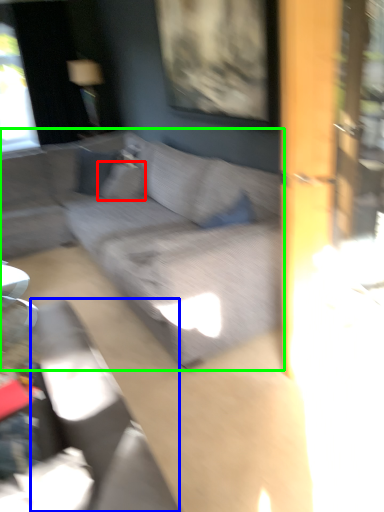
Question: Estimate the real-world distances between objects in this image. Which object is farther from pillow (highlighted by a red box), swivel chair (highlighted by a blue box) or studio couch (highlighted by a green box)?

Choices:
 (A) swivel chair
 (B) studio couch

Answer: (A)